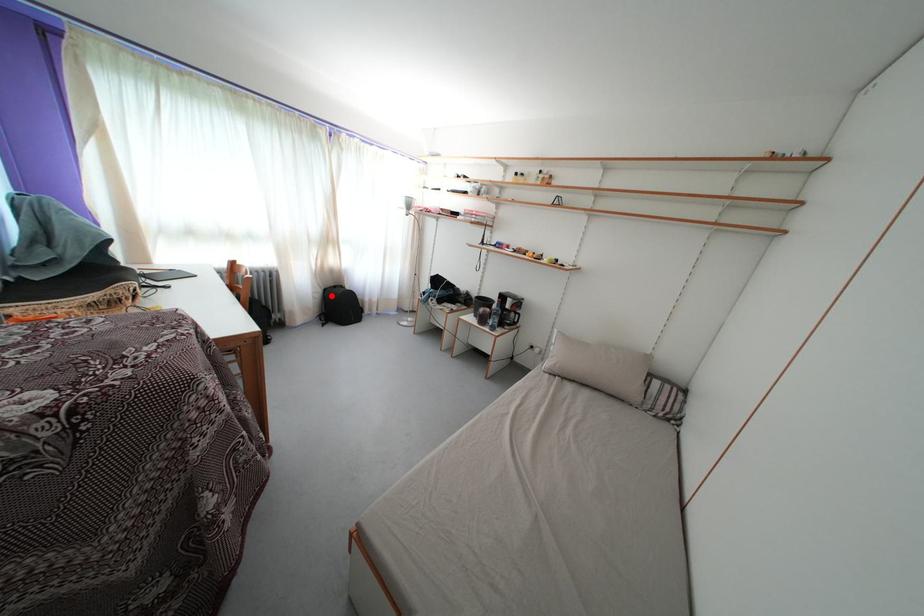
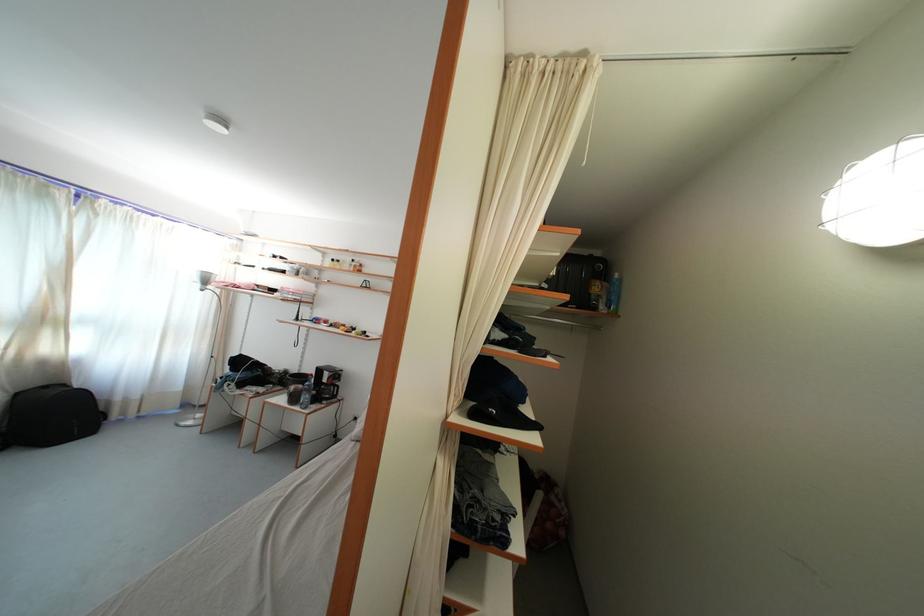
Question: I am providing you with two images of the same scene from different viewpoints. Given a red point in image1, look at the same physical point in image2. Is it:

Choices:
 (A) Closer to the viewpoint
 (B) Farther from the viewpoint

Answer: (B)